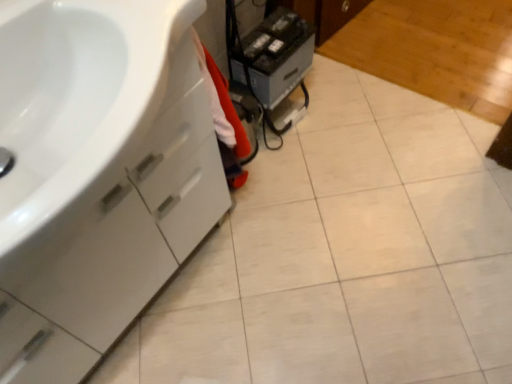
What do you see at coordinates (97, 174) in the screenshot? I see `white glossy cabinet at left` at bounding box center [97, 174].

I want to click on white glossy cabinet at left, so click(x=97, y=174).

In order to face white glossy cabinet at left, should I rotate leftwards or rightwards?

It's best to rotate left around 25.106 degrees.

What is the approximate width of black plastic printer at center?

black plastic printer at center is 8.42 inches in width.

Describe the element at coordinates (278, 55) in the screenshot. The height and width of the screenshot is (384, 512). I see `black plastic printer at center` at that location.

What are the coordinates of `black plastic printer at center` in the screenshot? It's located at (278, 55).

Measure the distance between point (267, 31) and camera.

Point (267, 31) is 4.54 feet away from camera.

Locate an element on the screen. white glossy cabinet at left is located at coordinates (97, 174).

Can you confirm if white glossy cabinet at left is positioned to the right of black plastic printer at center?

Incorrect, white glossy cabinet at left is not on the right side of black plastic printer at center.

Is white glossy cabinet at left in front of black plastic printer at center?

Yes, white glossy cabinet at left is closer to the camera.

Which is behind, point (83, 341) or point (284, 15)?

The point (284, 15) is behind.

From the image's perspective, relative to black plastic printer at center, is white glossy cabinet at left above or below?

Based on their image positions, white glossy cabinet at left is located beneath black plastic printer at center.

From a real-world perspective, is white glossy cabinet at left located higher than black plastic printer at center?

Yes, from a real-world perspective, white glossy cabinet at left is on top of black plastic printer at center.

Considering the sizes of objects white glossy cabinet at left and black plastic printer at center in the image provided, who is thinner, white glossy cabinet at left or black plastic printer at center?

black plastic printer at center is thinner.

Can you confirm if white glossy cabinet at left is shorter than black plastic printer at center?

In fact, white glossy cabinet at left may be taller than black plastic printer at center.

From the picture: Between white glossy cabinet at left and black plastic printer at center, which one has smaller size?

With smaller size is black plastic printer at center.

Is white glossy cabinet at left completely or partially outside of black plastic printer at center?

→ Absolutely, white glossy cabinet at left is external to black plastic printer at center.

Can you see white glossy cabinet at left touching black plastic printer at center?

No.

Is white glossy cabinet at left aimed at black plastic printer at center?

No, white glossy cabinet at left does not turn towards black plastic printer at center.

How far apart are white glossy cabinet at left and black plastic printer at center?

white glossy cabinet at left is 25.59 inches from black plastic printer at center.

The image size is (512, 384). In order to click on appliance lying behind the white glossy cabinet at left in this screenshot , I will do `click(278, 55)`.

Considering the positions of objects black plastic printer at center and white glossy cabinet at left in the image provided, who is more to the right, black plastic printer at center or white glossy cabinet at left?

From the viewer's perspective, black plastic printer at center appears more on the right side.

Considering the positions of objects black plastic printer at center and white glossy cabinet at left in the image provided, who is in front, black plastic printer at center or white glossy cabinet at left?

white glossy cabinet at left is in front.

Is point (288, 25) positioned behind point (22, 230)?

Yes, it is.

From the image's perspective, is black plastic printer at center located beneath white glossy cabinet at left?

Incorrect, from the image's perspective, black plastic printer at center is higher than white glossy cabinet at left.

From a real-world perspective, is black plastic printer at center under white glossy cabinet at left?

Yes, from a real-world perspective, black plastic printer at center is below white glossy cabinet at left.

Considering the sizes of objects black plastic printer at center and white glossy cabinet at left in the image provided, who is thinner, black plastic printer at center or white glossy cabinet at left?

With smaller width is black plastic printer at center.

Considering the relative sizes of black plastic printer at center and white glossy cabinet at left in the image provided, is black plastic printer at center taller than white glossy cabinet at left?

In fact, black plastic printer at center may be shorter than white glossy cabinet at left.

Who is smaller, black plastic printer at center or white glossy cabinet at left?

black plastic printer at center.

Is white glossy cabinet at left a part of black plastic printer at center?

Definitely not — white glossy cabinet at left is not inside black plastic printer at center.

Is black plastic printer at center positioned far away from white glossy cabinet at left?

Actually, black plastic printer at center and white glossy cabinet at left are a little close together.

Could you tell me if black plastic printer at center is facing white glossy cabinet at left?

No, black plastic printer at center is not turned towards white glossy cabinet at left.

You are a GUI agent. You are given a task and a screenshot of the screen. Output one action in this format:
    pyautogui.click(x=<x>, y=<y>)
    Task: Click on the appliance lying above the white glossy cabinet at left (from the image's perspective)
    
    Given the screenshot: What is the action you would take?
    pyautogui.click(x=278, y=55)

Identify the location of appliance that appears on the right of white glossy cabinet at left. (278, 55).

This screenshot has height=384, width=512. What are the coordinates of `appliance lying behind the white glossy cabinet at left` in the screenshot? It's located at (278, 55).